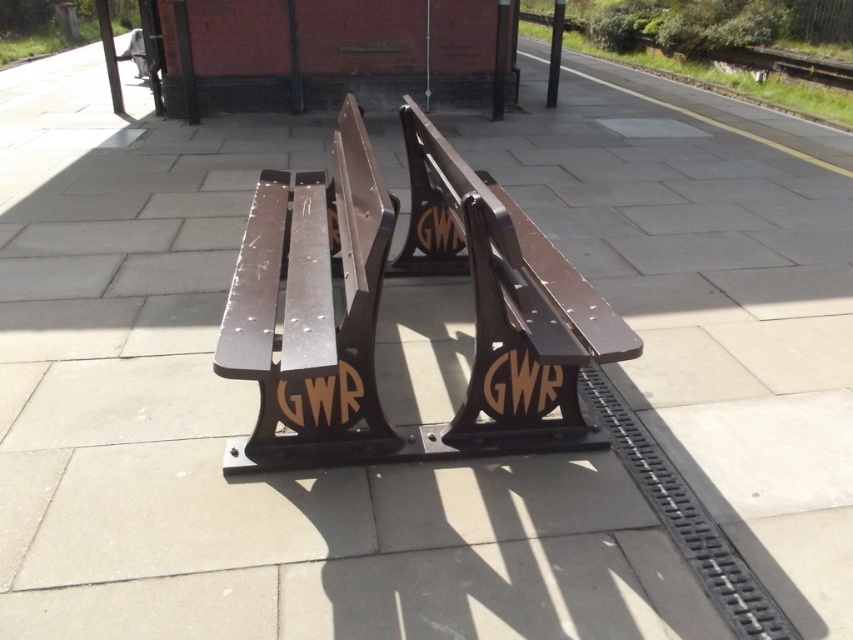
Is metallic brown bench at center thinner than brown polished wood bench at center?

Yes, metallic brown bench at center is thinner than brown polished wood bench at center.

At what (x,y) coordinates should I click in order to perform the action: click on metallic brown bench at center. Please return your answer as a coordinate pair (x, y). Looking at the image, I should click on (312, 310).

Which is in front, point (374, 381) or point (397, 273)?

Point (374, 381)

Locate an element on the screen. The image size is (853, 640). metallic brown bench at center is located at coordinates (312, 310).